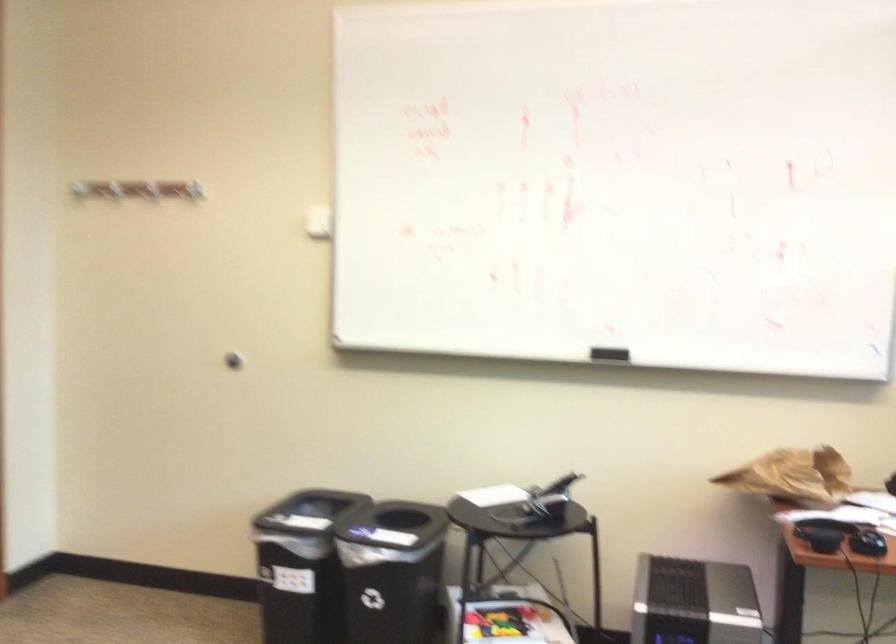
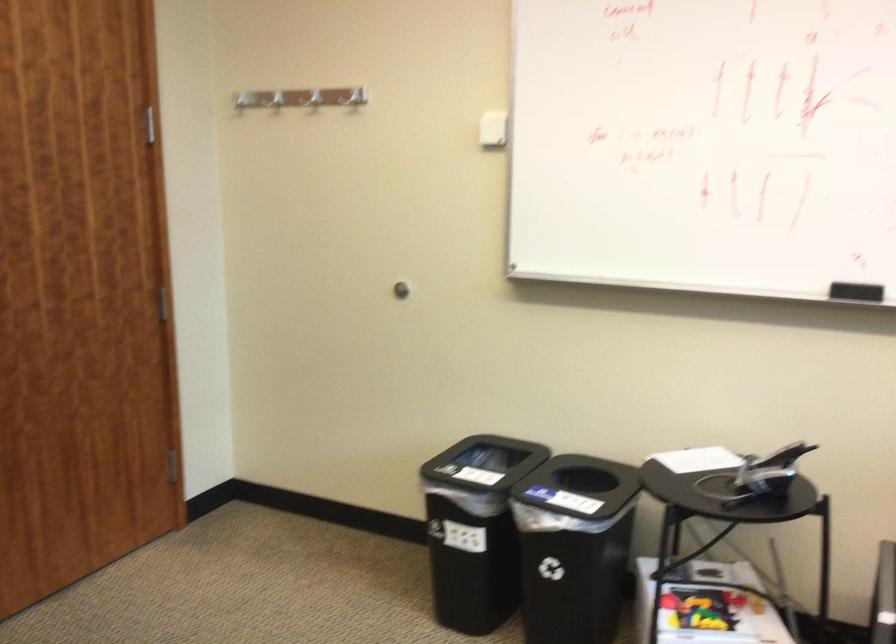
Locate, in the second image, the point that corresponds to pixel 151 182 in the first image.

(313, 98)